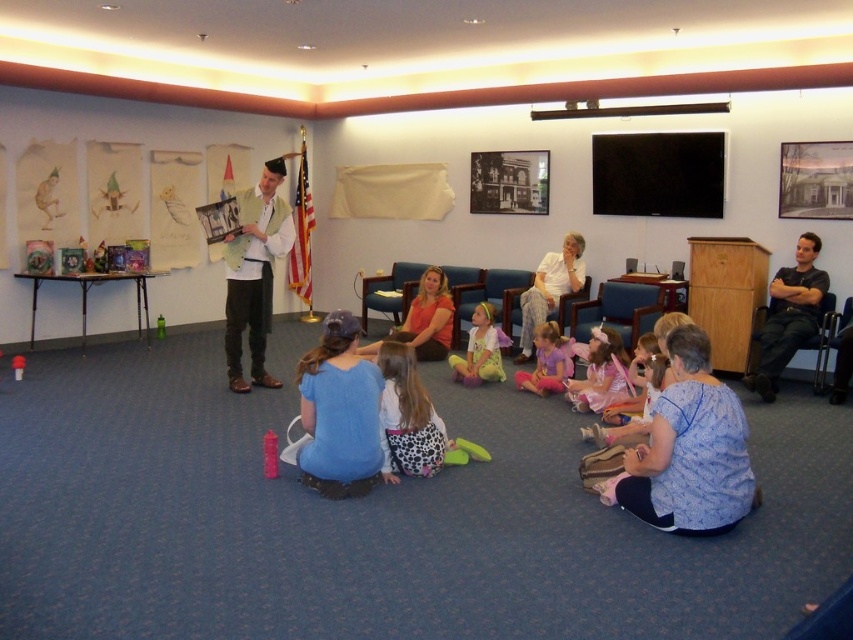
What are the coordinates of the light brown leather jacket at center?

The light brown leather jacket at center is located at coordinates point (254, 273).